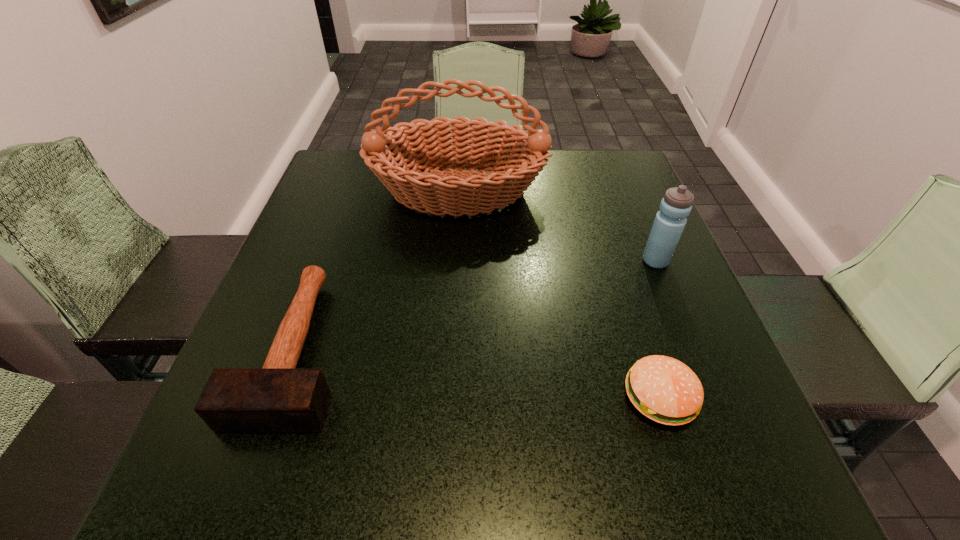
Where is `the tallest object`? the tallest object is located at coordinates tap(419, 147).

I want to click on basket, so click(419, 147).

What are the coordinates of `the second farthest object` in the screenshot? It's located at (676, 205).

Identify the location of the second tallest object. (676, 205).

Find the location of `mallet`. mallet is located at coordinates (278, 397).

This screenshot has width=960, height=540. Identify the location of patty. (665, 390).

Find the location of a particular element. The image size is (960, 540). free location located on the right of the tallest object is located at coordinates (570, 192).

The width and height of the screenshot is (960, 540). Identify the location of free spot located on the front of the third shortest object. (732, 446).

Where is `free space located on the hammer head face of the mallet`? This screenshot has width=960, height=540. free space located on the hammer head face of the mallet is located at coordinates (248, 487).

You are a GUI agent. You are given a task and a screenshot of the screen. Output one action in this format:
    pyautogui.click(x=<x>, y=<y>)
    Task: Click on the vacant space situated on the back of the shortest object
    
    Given the screenshot: What is the action you would take?
    pyautogui.click(x=620, y=273)